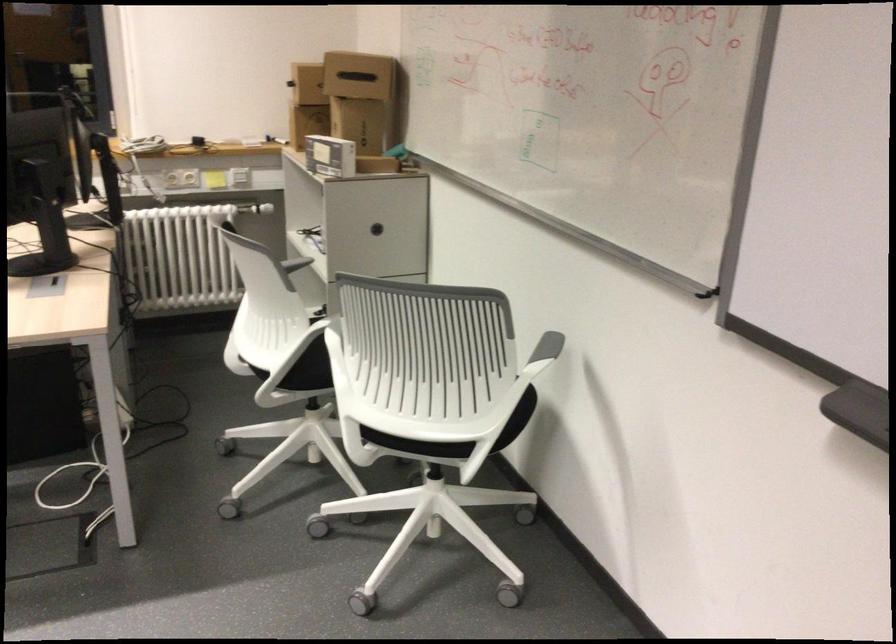
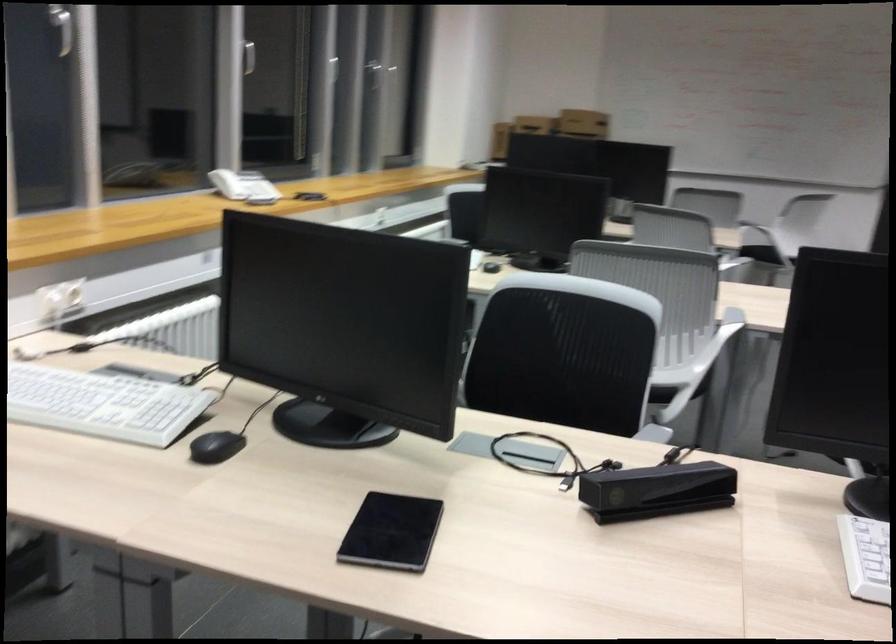
Question: I am providing you with two images of the same scene from different viewpoints. Which of the following objects are not visible in image2?

Choices:
 (A) blue patterned teacup
 (B) chair sitting surface
 (C) telephone handset
 (D) gray chair armrest

Answer: (D)